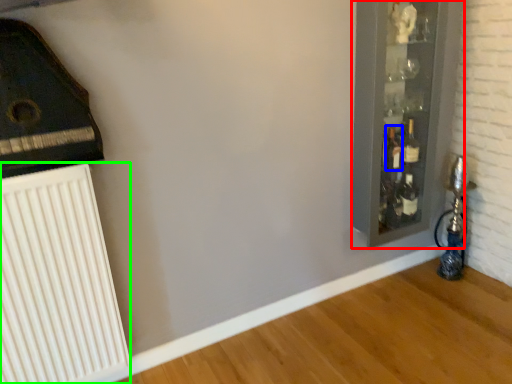
Question: Estimate the real-world distances between objects in this image. Which object is farther from glass door (highlighted by a red box), bottle (highlighted by a blue box) or radiator (highlighted by a green box)?

Choices:
 (A) bottle
 (B) radiator

Answer: (B)